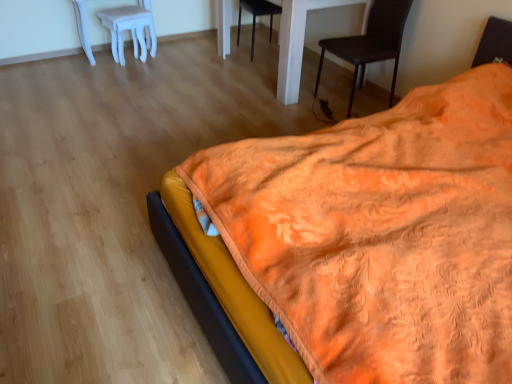
Question: From the image's perspective, does white glossy table at center appear lower than black matte chair at center, the 1th chair viewed from the left?

Choices:
 (A) yes
 (B) no

Answer: (A)

Question: Are white glossy table at center and black matte chair at center, acting as the 1th chair starting from the back, far apart?

Choices:
 (A) no
 (B) yes

Answer: (B)

Question: Considering the relative sizes of white glossy table at center and black matte chair at center, acting as the second chair starting from the front, in the image provided, is white glossy table at center bigger than black matte chair at center, acting as the second chair starting from the front,?

Choices:
 (A) no
 (B) yes

Answer: (B)

Question: Considering the relative sizes of white glossy table at center and black matte chair at center, arranged as the 2th chair when viewed from the right, in the image provided, is white glossy table at center smaller than black matte chair at center, arranged as the 2th chair when viewed from the right,?

Choices:
 (A) yes
 (B) no

Answer: (B)

Question: Is white glossy table at center oriented away from black matte chair at center, arranged as the 2th chair when viewed from the right?

Choices:
 (A) yes
 (B) no

Answer: (B)

Question: In terms of height, does white glossy table at center look taller or shorter compared to black matte chair at center, acting as the second chair starting from the front?

Choices:
 (A) tall
 (B) short

Answer: (A)

Question: Considering their positions, is white glossy table at center located in front of or behind black matte chair at center, acting as the second chair starting from the front?

Choices:
 (A) front
 (B) behind

Answer: (A)

Question: Looking at the image, does white glossy table at center seem bigger or smaller compared to black matte chair at center, acting as the 1th chair starting from the back?

Choices:
 (A) small
 (B) big

Answer: (B)

Question: From a real-world perspective, is white glossy table at center physically located above or below black matte chair at center, acting as the 1th chair starting from the back?

Choices:
 (A) below
 (B) above

Answer: (B)

Question: In terms of width, does black leather chair at upper right, which ranks as the 2th chair in back-to-front order, look wider or thinner when compared to black matte chair at center, the 1th chair viewed from the left?

Choices:
 (A) thin
 (B) wide

Answer: (B)

Question: Is black leather chair at upper right, which appears as the second chair when viewed from the left, to the left or to the right of black matte chair at center, acting as the second chair starting from the front, in the image?

Choices:
 (A) right
 (B) left

Answer: (A)

Question: In terms of height, does black leather chair at upper right, which appears as the second chair when viewed from the left, look taller or shorter compared to black matte chair at center, arranged as the 2th chair when viewed from the right?

Choices:
 (A) short
 (B) tall

Answer: (B)

Question: Is point (394, 39) closer or farther from the camera than point (251, 1)?

Choices:
 (A) closer
 (B) farther

Answer: (A)

Question: Considering the positions of point (285, 79) and point (137, 29), is point (285, 79) closer or farther from the camera than point (137, 29)?

Choices:
 (A) farther
 (B) closer

Answer: (B)

Question: Looking at their shapes, would you say white glossy table at center is wider or thinner than white plastic stool at upper left?

Choices:
 (A) thin
 (B) wide

Answer: (B)